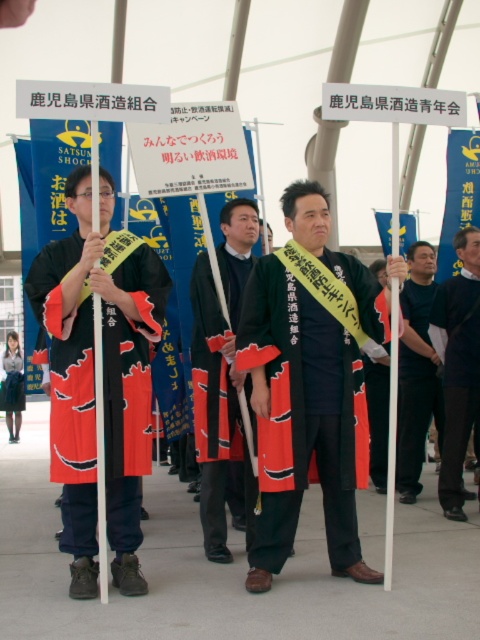
Which is above, matte black robe at center or black matte kimono at center?

black matte kimono at center

Measure the distance between point (282, 305) and camera.

Point (282, 305) and camera are 4.59 meters apart.

What do you see at coordinates (302, 413) in the screenshot? This screenshot has height=640, width=480. I see `matte black robe at center` at bounding box center [302, 413].

At what (x,y) coordinates should I click in order to perform the action: click on matte black robe at center. Please return your answer as a coordinate pair (x, y). The width and height of the screenshot is (480, 640). Looking at the image, I should click on click(302, 413).

The image size is (480, 640). Identify the location of black matte kimono at center. (220, 374).

Is black matte kimono at center further to camera compared to dark gray suit at right?

No, black matte kimono at center is in front of dark gray suit at right.

You are a GUI agent. You are given a task and a screenshot of the screen. Output one action in this format:
    pyautogui.click(x=<x>, y=<y>)
    Task: Click on the black matte kimono at center
    
    Given the screenshot: What is the action you would take?
    pyautogui.click(x=220, y=374)

Does matte black robe at center have a greater width compared to dark gray suit at right?

Yes, matte black robe at center is wider than dark gray suit at right.

What do you see at coordinates (302, 413) in the screenshot?
I see `matte black robe at center` at bounding box center [302, 413].

Measure the distance between matte black robe at center and camera.

matte black robe at center and camera are 4.49 meters apart.

Locate an element on the screen. matte black robe at center is located at coordinates (302, 413).